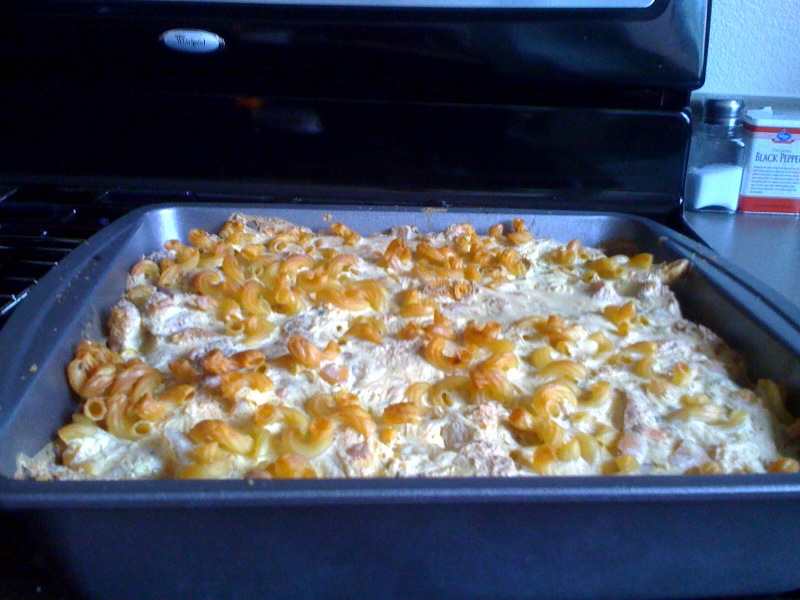
At what (x,y) coordinates should I click in order to perform the action: click on black pepper container. Please return your answer as a coordinate pair (x, y). This screenshot has height=600, width=800. Looking at the image, I should click on (780, 171).